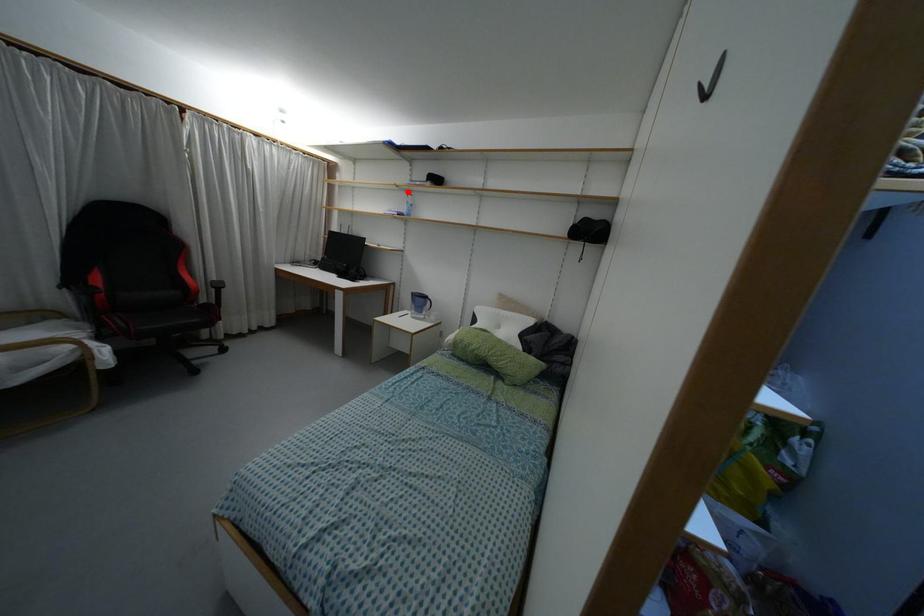
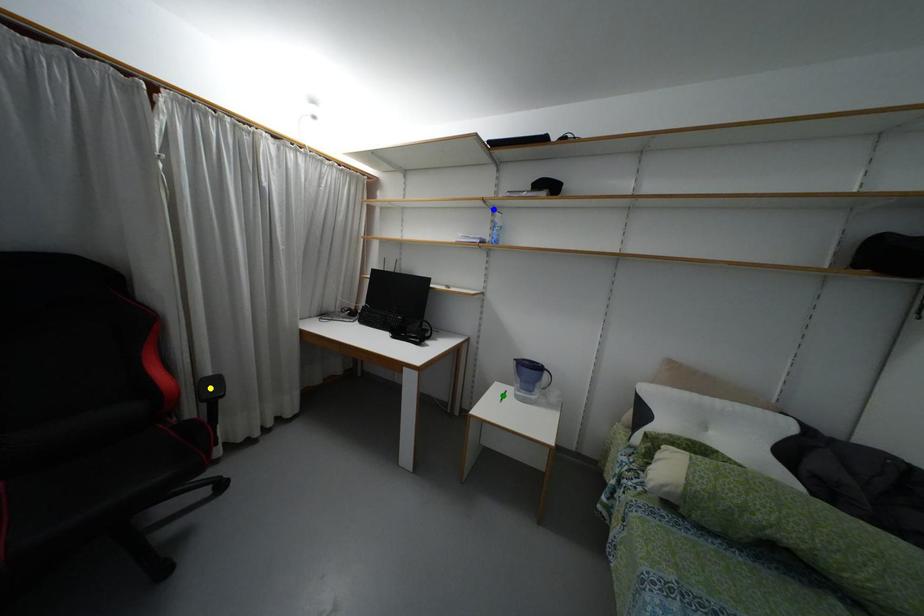
Question: I am providing you with two images of the same scene from different viewpoints. A red point is marked on the first image. You are given multiple points on the second image. Which point in image 2 represents the same 3d spot as the red point in image 1?

Choices:
 (A) green point
 (B) yellow point
 (C) blue point

Answer: (C)